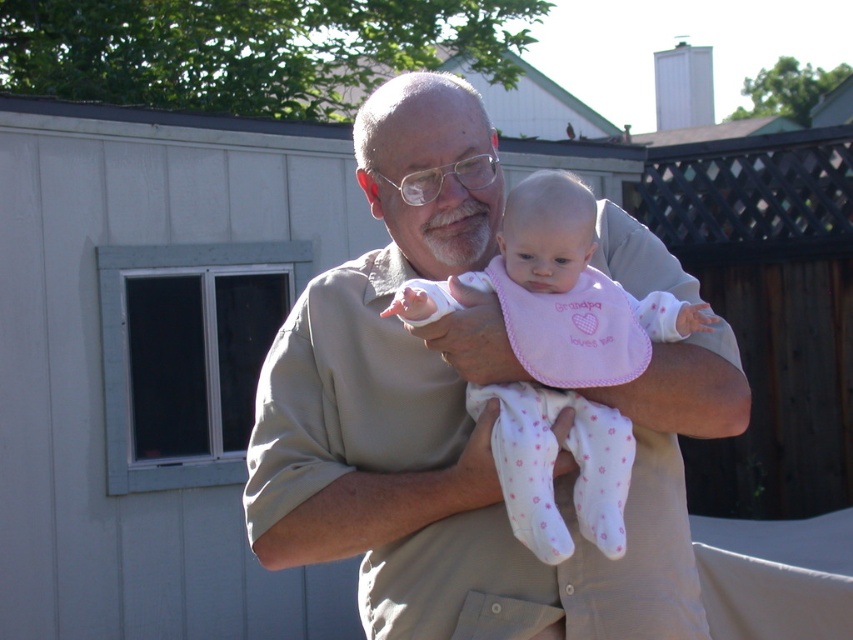
Question: Does khaki cotton shirt at center have a larger size compared to pink fabric bib at center?

Choices:
 (A) no
 (B) yes

Answer: (B)

Question: Among these points, which one is farthest from the camera?

Choices:
 (A) [x=502, y=289]
 (B) [x=438, y=273]

Answer: (B)

Question: Can you confirm if khaki cotton shirt at center is positioned above pink fabric bib at center?

Choices:
 (A) no
 (B) yes

Answer: (B)

Question: Can you confirm if khaki cotton shirt at center is smaller than pink fabric bib at center?

Choices:
 (A) yes
 (B) no

Answer: (B)